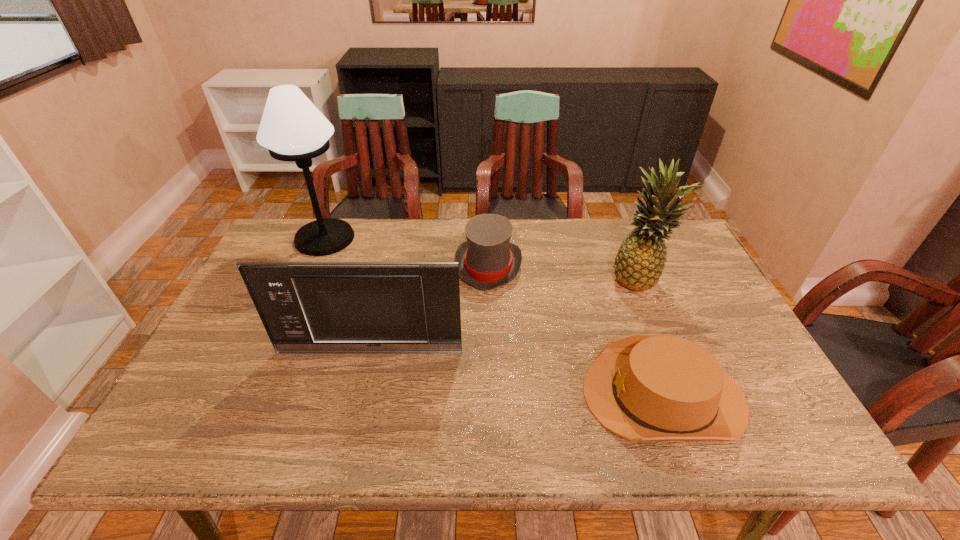
What are the coordinates of `vacant space located 0.230m on the front-facing side of the cowboy hat` in the screenshot? It's located at (483, 395).

The width and height of the screenshot is (960, 540). I want to click on vacant region located on the front-facing side of the cowboy hat, so click(x=505, y=395).

Locate an element on the screen. table lamp located at the far edge is located at coordinates (292, 128).

Find the location of `pineapple at the far edge`. pineapple at the far edge is located at coordinates click(x=640, y=260).

This screenshot has height=540, width=960. I want to click on dress hat located in the far edge section of the desktop, so click(487, 260).

The height and width of the screenshot is (540, 960). What are the coordinates of `object positioned at the near edge` in the screenshot? It's located at (643, 387).

This screenshot has height=540, width=960. I want to click on object positioned at the left edge, so click(x=292, y=128).

At what (x,y) coordinates should I click in order to perform the action: click on pineapple positioned at the right edge. Please return your answer as a coordinate pair (x, y). Looking at the image, I should click on (640, 260).

The height and width of the screenshot is (540, 960). What are the coordinates of `cowboy hat that is positioned at the right edge` in the screenshot? It's located at (643, 387).

The height and width of the screenshot is (540, 960). I want to click on object situated at the far left corner, so click(292, 128).